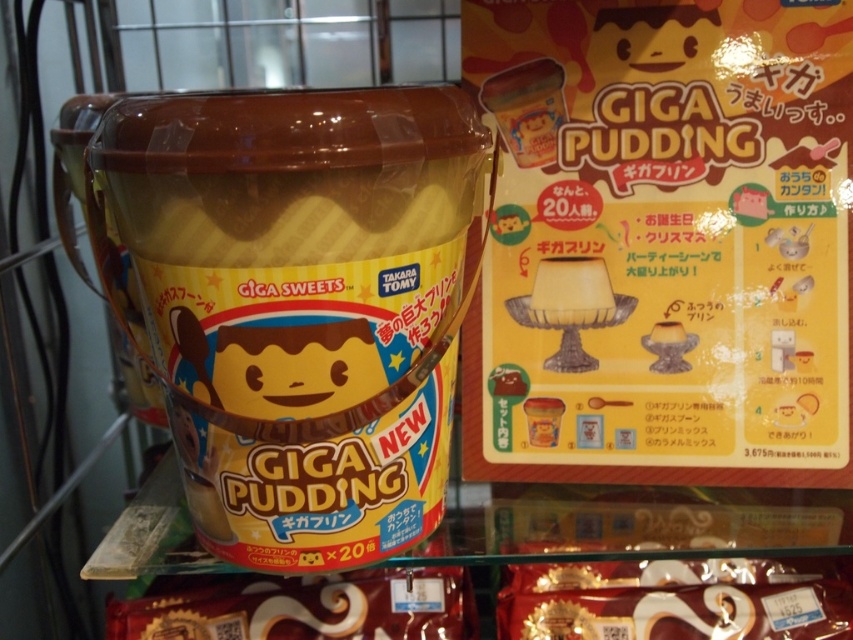
Is point (633, 74) positioned in front of point (575, 593)?

Yes, point (633, 74) is in front of point (575, 593).

Find the location of a particular element. This screenshot has height=640, width=853. matte yellow pudding at center is located at coordinates (666, 230).

Is matte yellow pudding at center smaller than matte plastic pudding at center?

Correct, matte yellow pudding at center occupies less space than matte plastic pudding at center.

Find the location of a particular element. matte yellow pudding at center is located at coordinates (666, 230).

Is matte plastic pudding at center taller than shiny chocolate bar at lower right?

Correct, matte plastic pudding at center is much taller as shiny chocolate bar at lower right.

Is matte plastic pudding at center below shiny chocolate bar at lower right?

No, matte plastic pudding at center is not below shiny chocolate bar at lower right.

Does point (207, 355) come closer to viewer compared to point (541, 609)?

Yes, it is in front of point (541, 609).

You are a GUI agent. You are given a task and a screenshot of the screen. Output one action in this format:
    pyautogui.click(x=<x>, y=<y>)
    Task: Click on the matte plastic pudding at center
    This screenshot has width=853, height=640.
    Given the screenshot: What is the action you would take?
    pyautogui.click(x=300, y=305)